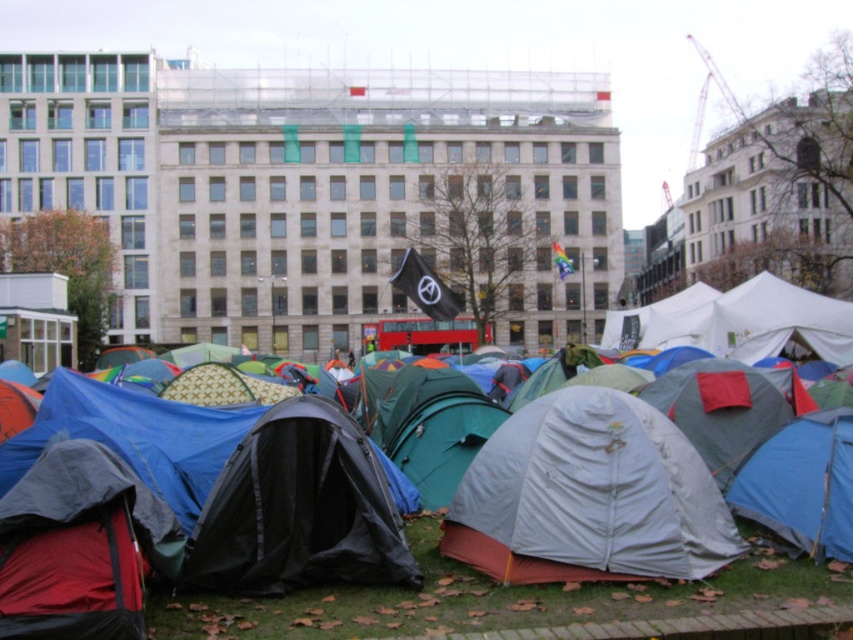
Is multicolored tents at center behind white matte tent at center?

Yes, it is.

Is multicolored tents at center below white matte tent at center?

Correct, multicolored tents at center is located below white matte tent at center.

What do you see at coordinates (480, 595) in the screenshot?
I see `multicolored tents at center` at bounding box center [480, 595].

The height and width of the screenshot is (640, 853). What are the coordinates of `multicolored tents at center` in the screenshot? It's located at (480, 595).